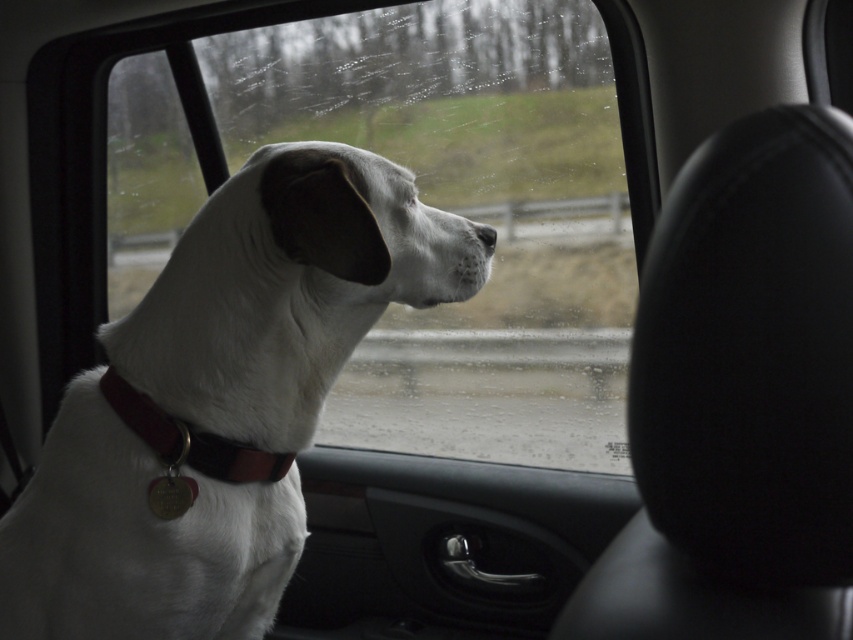
In the scene shown: You are a veterinarian examining the image of a vehicle interior. You notice the white matte dog at center and the brown leather collar at center. Based on their sizes in the image, which object occupies more space horizontally?

The white matte dog at center has a larger width than the brown leather collar at center, so it occupies more horizontal space.

You are sitting in the back seat of the car and want to look outside through the transparent glass window at center. To do so, you need to move past the black leather headrest at right. Is the window above or below the headrest?

The transparent glass window at center is above the black leather headrest at right, so you can look over the headrest to see outside through the window.

You are a passenger in a car and see the white matte dog at center and the brown leather collar at center. Which object is closer to you?

The white matte dog at center is closer to you because it is positioned over the brown leather collar at center, indicating it is in a more forward position.